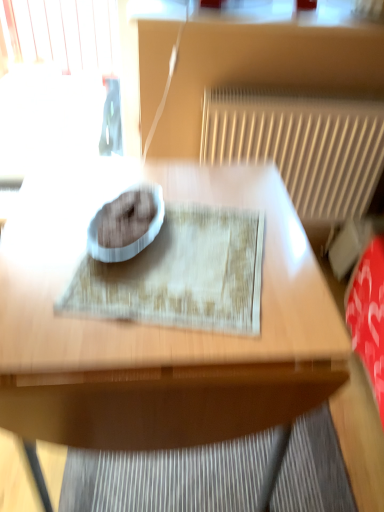
Locate an element on the screen. vacant space underneath textured beige mat at center (from a real-world perspective) is located at coordinates [x=185, y=266].